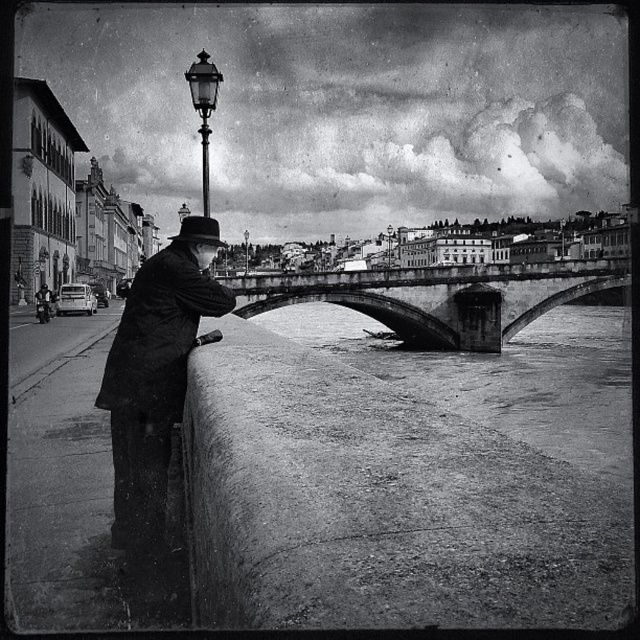
Question: Among these objects, which one is farthest from the camera?

Choices:
 (A) rough concrete river at center
 (B) concrete stone bridge at center
 (C) black felt hat at upper center

Answer: (B)

Question: Can you confirm if rough concrete river at center is positioned below concrete stone bridge at center?

Choices:
 (A) no
 (B) yes

Answer: (B)

Question: Which point appears farthest from the camera in this image?

Choices:
 (A) (193, 67)
 (B) (188, 288)
 (C) (211, 221)

Answer: (A)

Question: Observing the image, what is the correct spatial positioning of concrete stone bridge at center in reference to black felt hat at upper center?

Choices:
 (A) below
 (B) above

Answer: (A)

Question: Is the position of rough concrete river at center more distant than that of dark matte coat at left?

Choices:
 (A) yes
 (B) no

Answer: (A)

Question: Which object is positioned farthest from the rough concrete river at center?

Choices:
 (A) dark matte coat at left
 (B) polished brass streetlamp at upper center

Answer: (A)